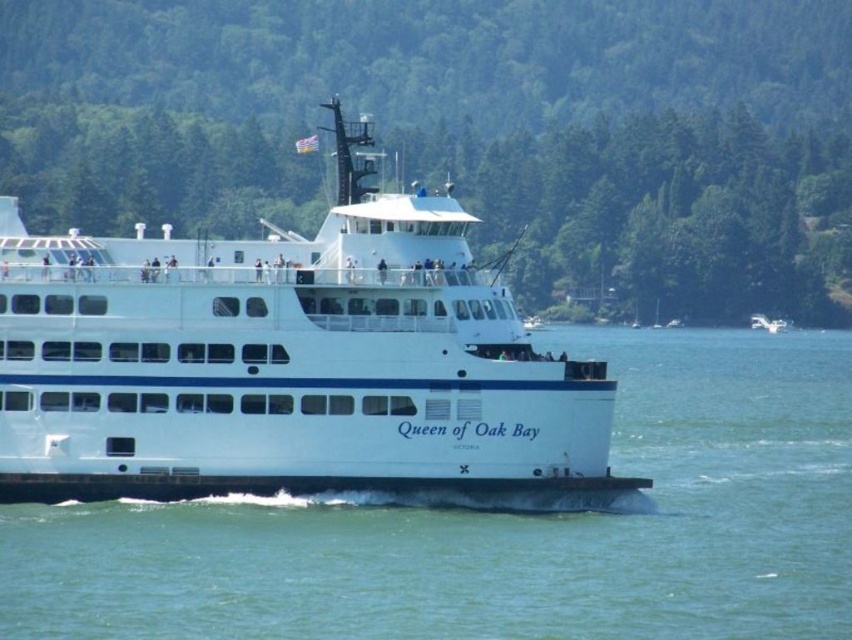
Which is more to the left, green leafy trees at center or white matte ferry at center?

From the viewer's perspective, green leafy trees at center appears more on the left side.

Measure the distance between green leafy trees at center and camera.

green leafy trees at center and camera are 195.79 meters apart.

At what (x,y) coordinates should I click in order to perform the action: click on green leafy trees at center. Please return your answer as a coordinate pair (x, y). This screenshot has height=640, width=852. Looking at the image, I should click on (465, 132).

Is point (153, 284) positioned after point (755, 314)?

No, (153, 284) is closer to viewer.

Between white glossy cruise ship at center and white matte ferry at center, which one appears on the left side from the viewer's perspective?

Positioned to the left is white glossy cruise ship at center.

Is point (135, 458) positioned behind point (751, 323)?

No, it is not.

Image resolution: width=852 pixels, height=640 pixels. Find the location of `white glossy cruise ship at center`. white glossy cruise ship at center is located at coordinates (286, 360).

Which is more to the right, green leafy trees at center or clear blue water at center?

Positioned to the right is clear blue water at center.

Is point (190, 150) more distant than point (772, 477)?

That is True.

Find the location of a particular element. green leafy trees at center is located at coordinates (465, 132).

The width and height of the screenshot is (852, 640). Find the location of `green leafy trees at center`. green leafy trees at center is located at coordinates (465, 132).